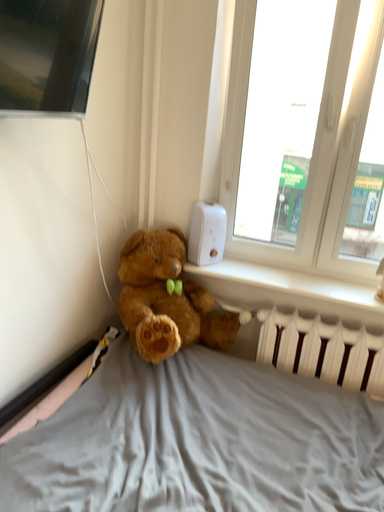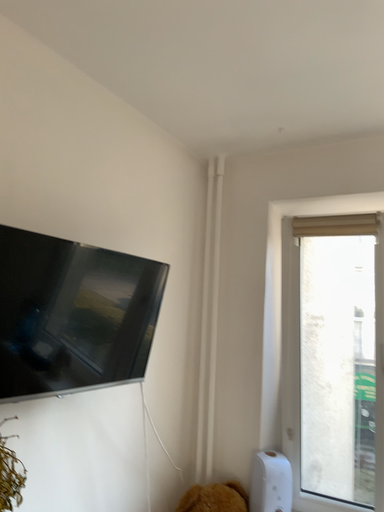
Question: How did the camera likely rotate when shooting the video?

Choices:
 (A) rotated downward
 (B) rotated upward

Answer: (B)